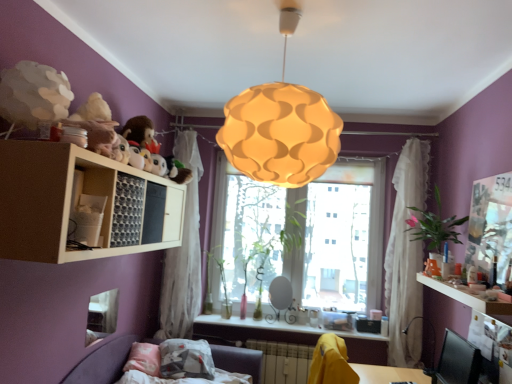
Question: Considering the positions of green matte plant at window, marked as the 4th plant in a front-to-back arrangement, and matte white shelf at lower center, which ranks as the 2th counter top in right-to-left order, in the image, is green matte plant at window, marked as the 4th plant in a front-to-back arrangement, wider or thinner than matte white shelf at lower center, which ranks as the 2th counter top in right-to-left order,?

Choices:
 (A) thin
 (B) wide

Answer: (A)

Question: Would you say green matte plant at window, positioned as the first plant in back-to-front order, is to the left or to the right of matte white shelf at lower center, placed as the 1th counter top when sorted from bottom to top, in the picture?

Choices:
 (A) right
 (B) left

Answer: (B)

Question: Estimate the real-world distances between objects in this image. Which object is closer to the white sheer curtain at left, the second curtain viewed from the right?

Choices:
 (A) fluffy plush toys at upper left
 (B) matte orange lampshade at center
 (C) green glossy plant at window, which appears as the first plant when viewed from the left
 (D) purple fabric couch at lower left
 (E) translucent glass window at center

Answer: (C)

Question: Based on their relative distances, which object is farther from the matte orange lampshade at center?

Choices:
 (A) matte purple counter top at right, the 2th counter top when ordered from back to front
 (B) white matte shelf at upper left
 (C) white sheer curtain at right, placed as the 2th curtain when sorted from left to right
 (D) translucent glass window at center
 (E) matte white shelf at lower center, which is the second counter top from top to bottom

Answer: (E)